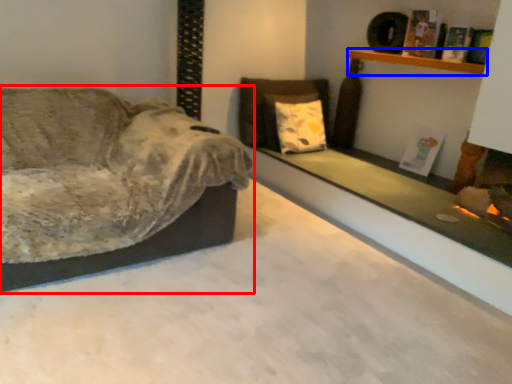
Question: Which of the following is the farthest to the observer, studio couch (highlighted by a red box) or shelf (highlighted by a blue box)?

Choices:
 (A) studio couch
 (B) shelf

Answer: (B)